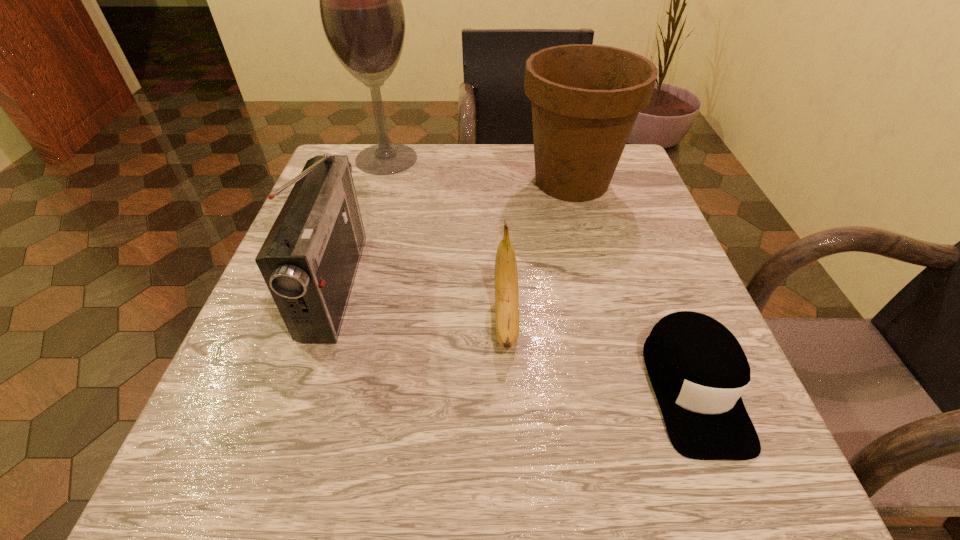
I want to click on alcohol located in the far edge section of the desktop, so tap(360, 0).

Where is `flowerpot present at the far edge`? The height and width of the screenshot is (540, 960). flowerpot present at the far edge is located at coordinates (585, 98).

The image size is (960, 540). Identify the location of object that is at the near edge. (698, 370).

Where is `alcohol present at the left edge`? alcohol present at the left edge is located at coordinates (360, 0).

Where is `radio receiver that is at the left edge`? radio receiver that is at the left edge is located at coordinates coord(309,260).

Identify the location of flowerpot that is positioned at the right edge. The width and height of the screenshot is (960, 540). coord(585,98).

Locate an element on the screen. cap located at the right edge is located at coordinates (698, 370).

What are the coordinates of `object at the far left corner` in the screenshot? It's located at (360, 0).

The height and width of the screenshot is (540, 960). What are the coordinates of `object positioned at the far right corner` in the screenshot? It's located at (585, 98).

Where is `object that is positioned at the near right corner`? Image resolution: width=960 pixels, height=540 pixels. object that is positioned at the near right corner is located at coordinates (698, 370).